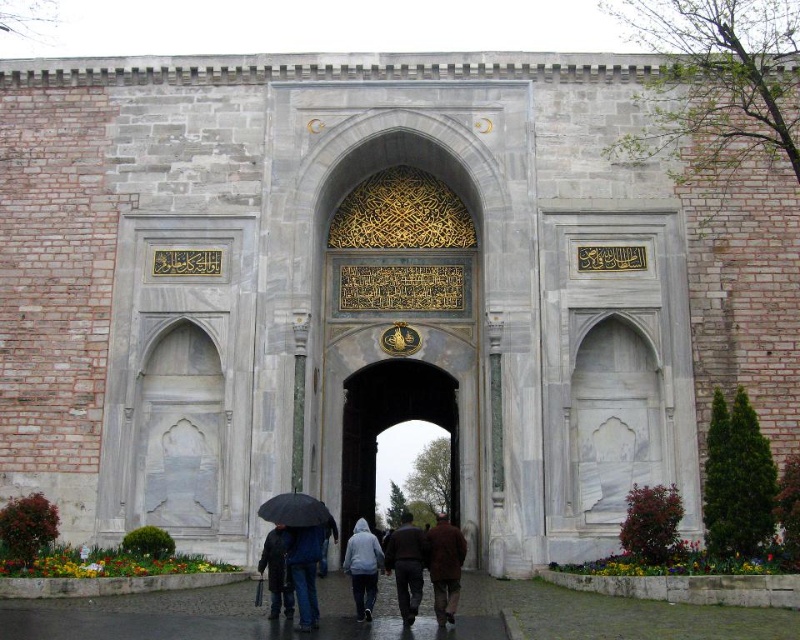
Question: Which point is farther to the camera?

Choices:
 (A) (284, 506)
 (B) (422, 580)
 (C) (308, 616)

Answer: (A)

Question: Which of these objects is positioned closest to the dark brown leather jacket at center?

Choices:
 (A) light gray hoodie at center
 (B) black matte umbrella at lower center
 (C) dark brown leather coat at lower center
 (D) gold metallic gate at center

Answer: (A)

Question: Does gold metallic gate at center appear on the left side of light gray hoodie at center?

Choices:
 (A) no
 (B) yes

Answer: (A)

Question: Which object appears closest to the camera in this image?

Choices:
 (A) gold metallic gate at center
 (B) dark blue jeans at center
 (C) dark brown leather jacket at center

Answer: (B)

Question: Can you confirm if dark blue jeans at center is positioned above dark brown leather coat at lower center?

Choices:
 (A) no
 (B) yes

Answer: (B)

Question: Where is gold metallic gate at center located in relation to dark brown leather coat at lower center in the image?

Choices:
 (A) above
 (B) below

Answer: (A)